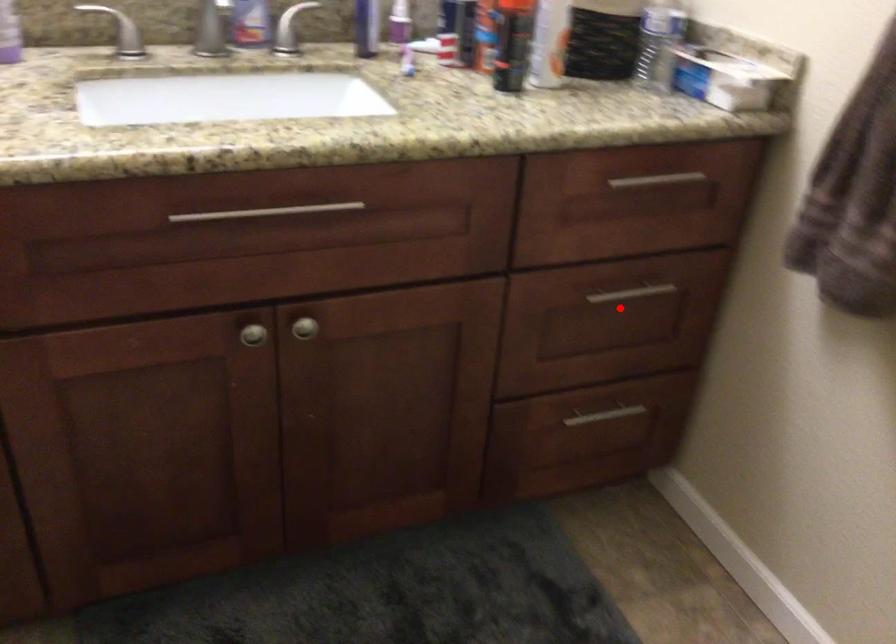
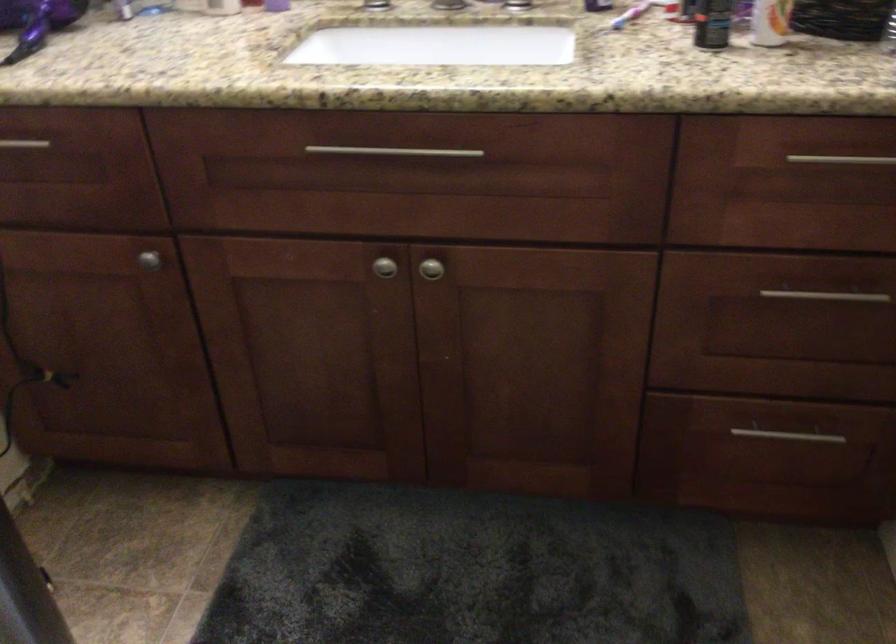
In the second image, find the point that corresponds to the highlighted location in the first image.

(815, 310)